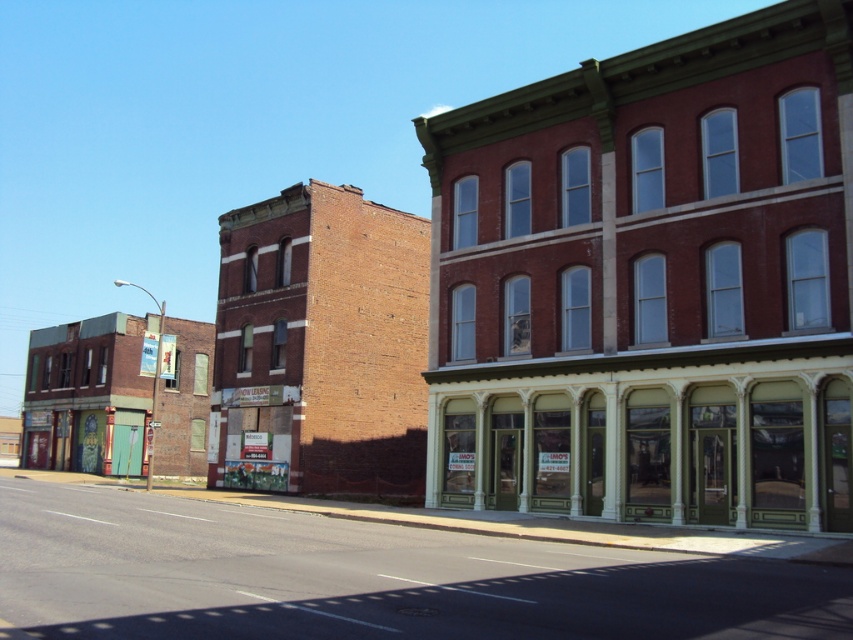
Question: Which point is closer to the camera?

Choices:
 (A) multicolored painted doors at lower left
 (B) green painted wood signboard at center
 (C) brick building at left

Answer: (B)

Question: Is green painted wood storefront at center below green painted wood signboard at center?

Choices:
 (A) no
 (B) yes

Answer: (A)

Question: Does green painted wood signboard at center appear over multicolored painted doors at lower left?

Choices:
 (A) no
 (B) yes

Answer: (B)

Question: Which of the following is the closest to the observer?

Choices:
 (A) green painted wood signboard at center
 (B) multicolored painted doors at lower left
 (C) brick building at left
 (D) green painted wood storefront at center

Answer: (D)

Question: Which object is farther from the camera taking this photo?

Choices:
 (A) brick building at left
 (B) green painted wood signboard at center
 (C) multicolored painted doors at lower left

Answer: (C)

Question: Is brick building at left closer to camera compared to green painted wood signboard at center?

Choices:
 (A) no
 (B) yes

Answer: (A)